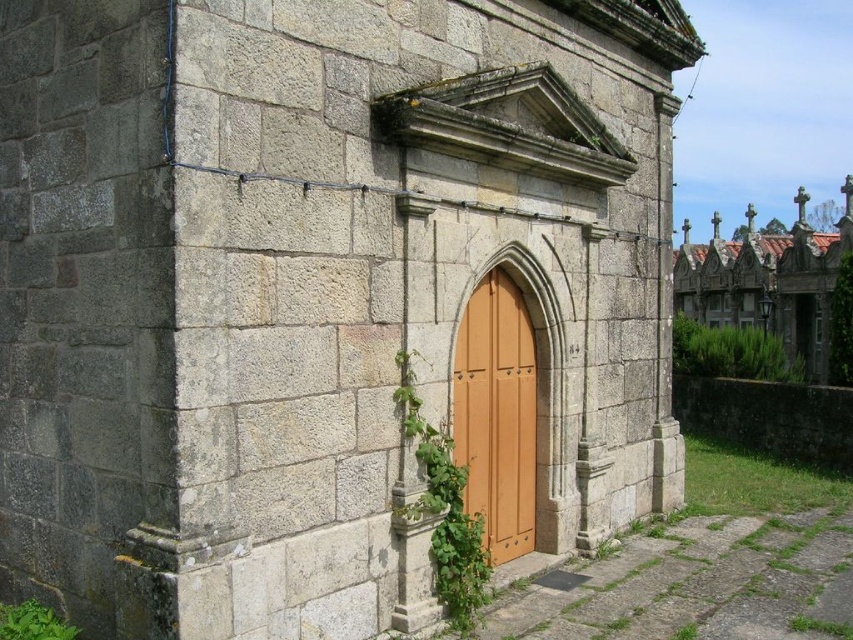
Question: Among these points, which one is farthest from the camera?

Choices:
 (A) (529, 387)
 (B) (780, 316)

Answer: (B)

Question: Which point is farther from the camera taking this photo?

Choices:
 (A) (514, 458)
 (B) (770, 262)

Answer: (B)

Question: Can you confirm if smooth gray stone church at upper right is positioned to the right of green leafy ivy at center?

Choices:
 (A) no
 (B) yes

Answer: (B)

Question: Does smooth gray stone church at upper right have a larger size compared to green leafy ivy at center?

Choices:
 (A) no
 (B) yes

Answer: (B)

Question: Which object appears farthest from the camera in this image?

Choices:
 (A) green leafy ivy at center
 (B) smooth gray stone church at upper right

Answer: (B)

Question: Can you confirm if wooden at center is bigger than smooth gray stone church at upper right?

Choices:
 (A) yes
 (B) no

Answer: (B)